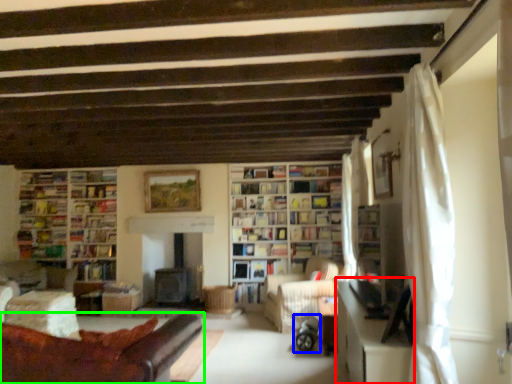
Question: Considering the real-world distances, which object is closest to table (highlighted by a red box)? baby carriage (highlighted by a blue box) or studio couch (highlighted by a green box).

Choices:
 (A) baby carriage
 (B) studio couch

Answer: (B)